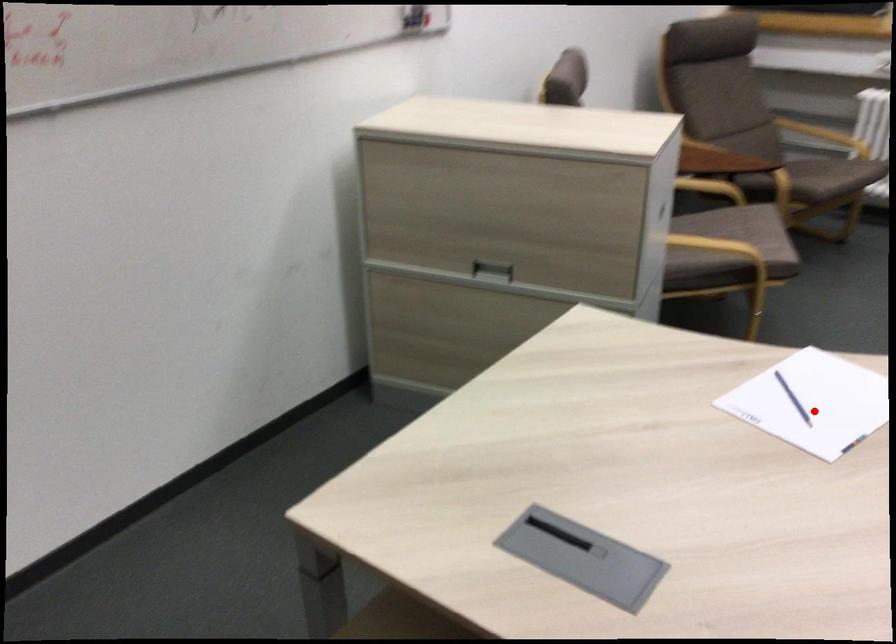
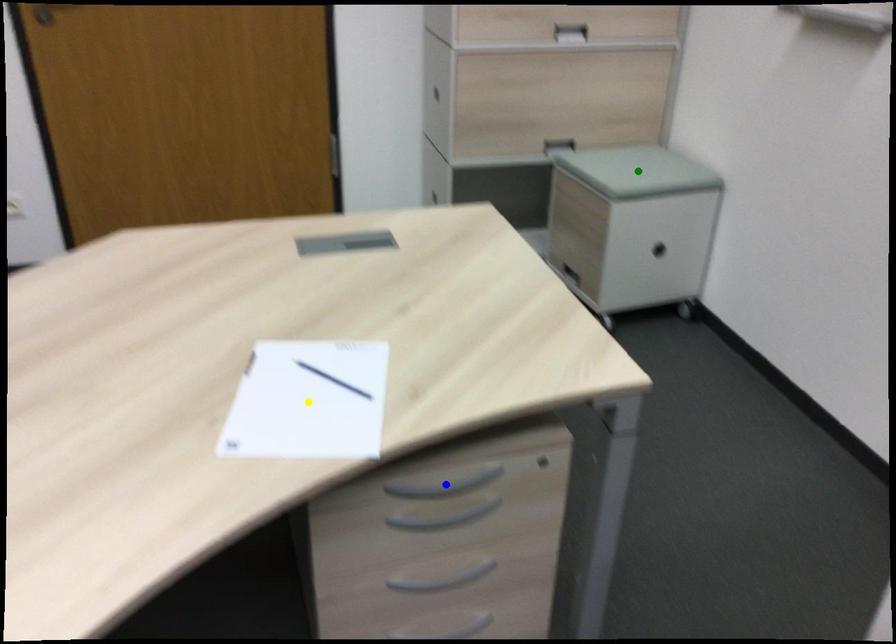
Question: I am providing you with two images of the same scene from different viewpoints. A red point is marked on the first image. You are given multiple points on the second image. In image 2, which mark is for the same physical point as the one in image 1?

Choices:
 (A) blue point
 (B) yellow point
 (C) green point

Answer: (B)